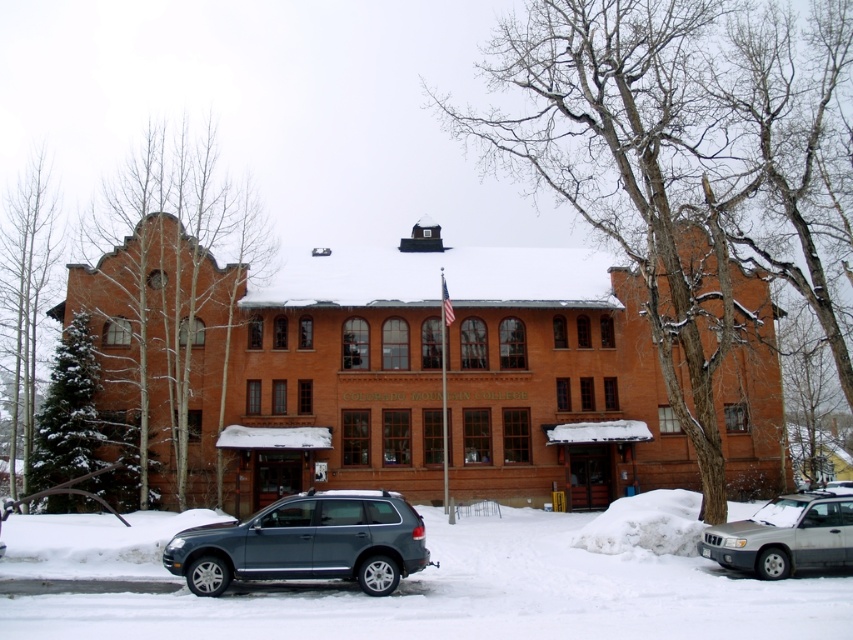
Question: Which object is positioned closest to the silver metallic suv at lower right?

Choices:
 (A) white powdery snow at lower center
 (B) metallic gray suv at center

Answer: (A)

Question: Based on their relative distances, which object is farther from the metallic gray suv at center?

Choices:
 (A) silver metallic suv at lower right
 (B) white powdery snow at lower center

Answer: (A)

Question: Is white powdery snow at lower center smaller than metallic gray suv at center?

Choices:
 (A) yes
 (B) no

Answer: (B)

Question: Considering the relative positions of metallic gray suv at center and silver metallic suv at lower right in the image provided, where is metallic gray suv at center located with respect to silver metallic suv at lower right?

Choices:
 (A) right
 (B) left

Answer: (B)

Question: Which point is farther to the camera?

Choices:
 (A) (260, 515)
 (B) (492, 600)
 (C) (784, 506)

Answer: (C)

Question: Is the position of metallic gray suv at center more distant than that of silver metallic suv at lower right?

Choices:
 (A) yes
 (B) no

Answer: (B)